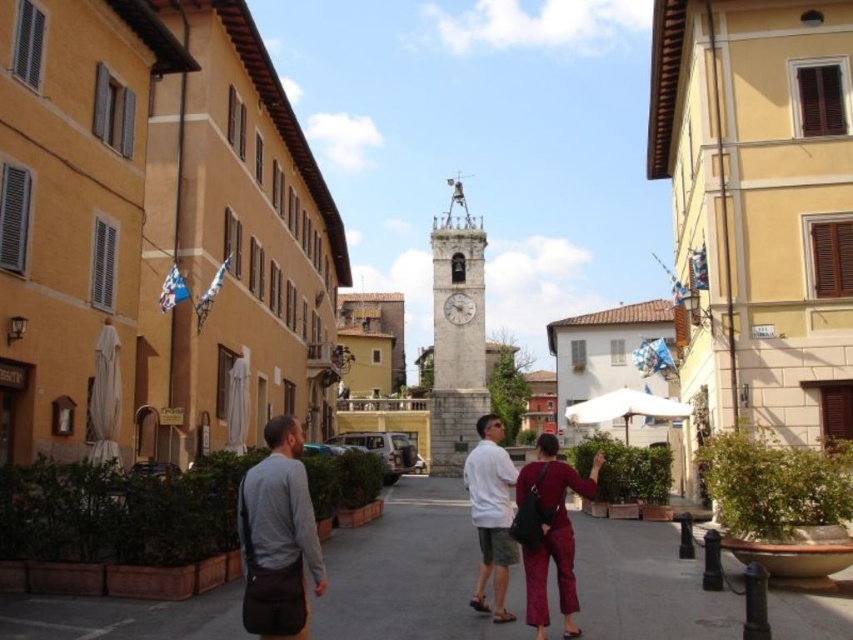
What are the coordinates of the stone clock tower at center?

The stone clock tower at center is located at coordinates point (456,336).

You are a tourist standing on the dark gray asphalt at center and want to take a photo of the stone clock tower at center. Which direction should you face to ensure the clock tower is in the background of your photo?

To have the stone clock tower at center in the background of your photo, you should face to the right side since the dark gray asphalt at center is positioned on the left side of the stone clock tower at center. This means the tower is to your right when standing on the asphalt.

You are a tourist holding a gray fabric bag at lower left and want to take a photo of the stone clock tower at center. Can you position yourself so that the tower is fully visible without the bag blocking it?

The stone clock tower at center is located above the gray fabric bag at lower left, so if you lift the bag or move it out of the way, the tower will be fully visible without obstruction.